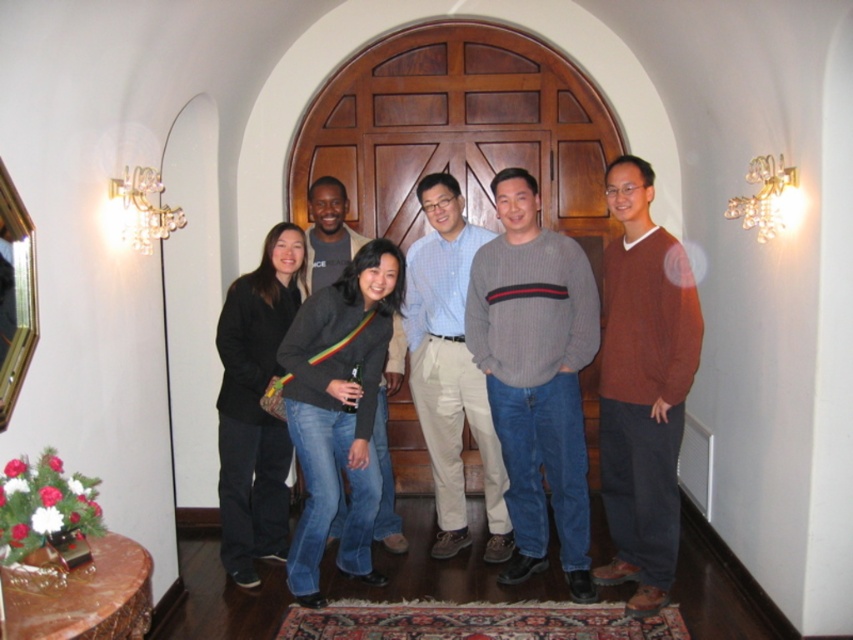
You are a photographer adjusting the camera focus. The matte brown sweater at right and dark gray sweater at center are in the frame. Which sweater should you focus on if you want to ensure the taller one is sharp?

The matte brown sweater at right is taller than the dark gray sweater at center, so focus on the matte brown sweater at right to ensure the taller one is sharp.

You are standing in front of the large wooden door and want to take a photo of the gray ribbed sweater at center. If your camera has a maximum focus range of 3 meters, will it be able to capture the sweater clearly?

The gray ribbed sweater at center is 3.17 meters away from the viewer. Since the camera can only focus up to 3 meters, it will not be able to capture the sweater clearly.